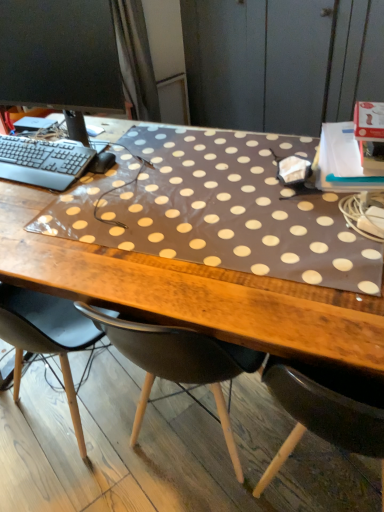
Question: From the image's perspective, is black plastic keyboard at left beneath brown fabric dresser at upper right?

Choices:
 (A) no
 (B) yes

Answer: (B)

Question: Is black plastic keyboard at left closer to camera compared to brown fabric dresser at upper right?

Choices:
 (A) no
 (B) yes

Answer: (B)

Question: Is black plastic keyboard at left behind brown fabric dresser at upper right?

Choices:
 (A) yes
 (B) no

Answer: (B)

Question: Are black plastic keyboard at left and brown fabric dresser at upper right far apart?

Choices:
 (A) yes
 (B) no

Answer: (A)

Question: Is brown fabric dresser at upper right surrounded by black plastic keyboard at left?

Choices:
 (A) no
 (B) yes

Answer: (A)

Question: Looking at the image, does black plastic keyboard at left seem bigger or smaller compared to black glossy monitor at upper left?

Choices:
 (A) big
 (B) small

Answer: (B)

Question: Considering the positions of black plastic keyboard at left and black glossy monitor at upper left in the image, is black plastic keyboard at left wider or thinner than black glossy monitor at upper left?

Choices:
 (A) thin
 (B) wide

Answer: (B)

Question: In the image, is black plastic keyboard at left positioned in front of or behind black glossy monitor at upper left?

Choices:
 (A) front
 (B) behind

Answer: (B)

Question: From the image's perspective, is black plastic keyboard at left positioned above or below black glossy monitor at upper left?

Choices:
 (A) above
 (B) below

Answer: (B)

Question: Considering their positions, is brown fabric dresser at upper right located in front of or behind black plastic keyboard at left?

Choices:
 (A) behind
 (B) front

Answer: (A)

Question: Is brown fabric dresser at upper right inside or outside of black plastic keyboard at left?

Choices:
 (A) outside
 (B) inside

Answer: (A)

Question: In the image, is brown fabric dresser at upper right on the left side or the right side of black plastic keyboard at left?

Choices:
 (A) right
 (B) left

Answer: (A)

Question: From a real-world perspective, is brown fabric dresser at upper right above or below black plastic keyboard at left?

Choices:
 (A) below
 (B) above

Answer: (A)

Question: Is black plastic keyboard at left spatially inside brown fabric dresser at upper right, or outside of it?

Choices:
 (A) outside
 (B) inside

Answer: (A)

Question: In terms of width, does black plastic keyboard at left look wider or thinner when compared to brown fabric dresser at upper right?

Choices:
 (A) thin
 (B) wide

Answer: (A)